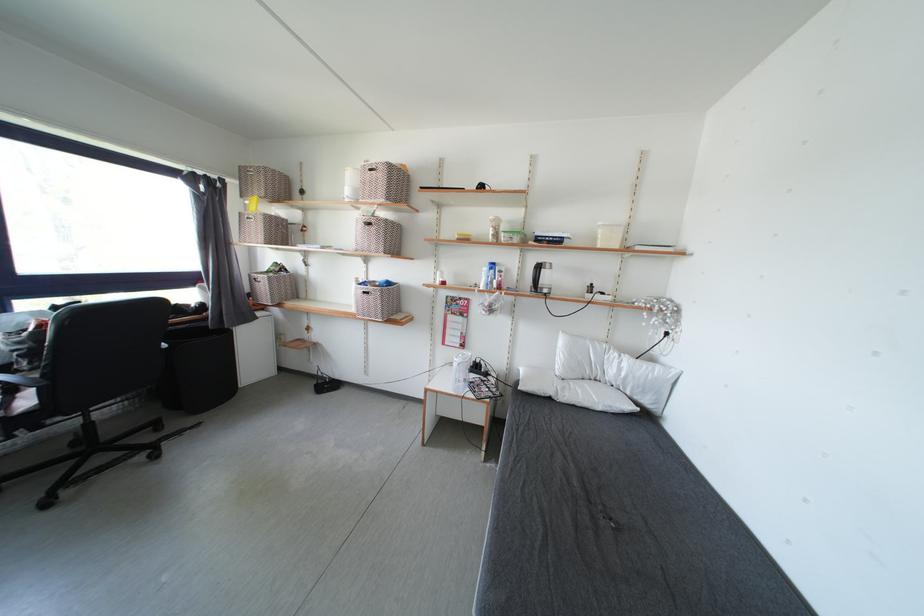
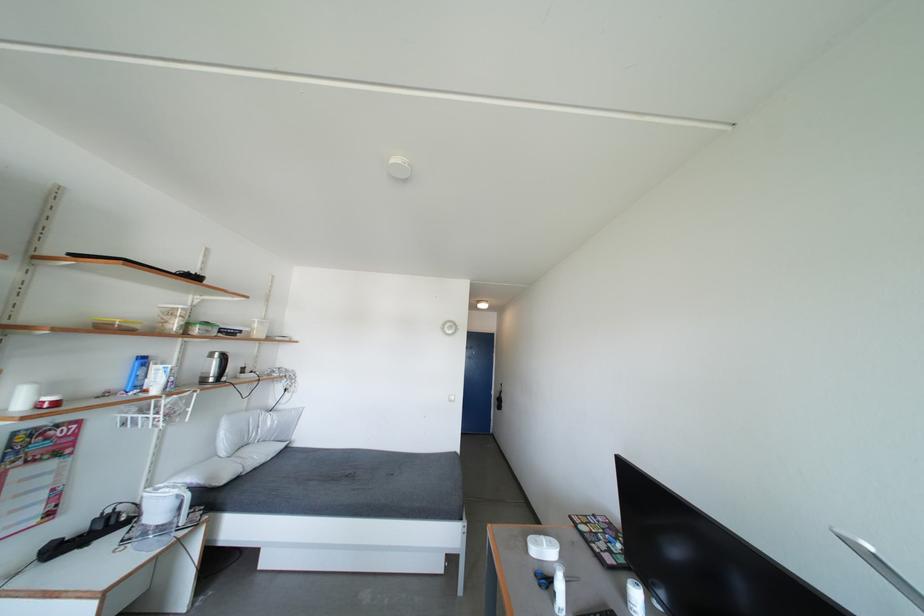
Where in the second image is the point corresponding to [515,240] from the first image?

(212, 333)